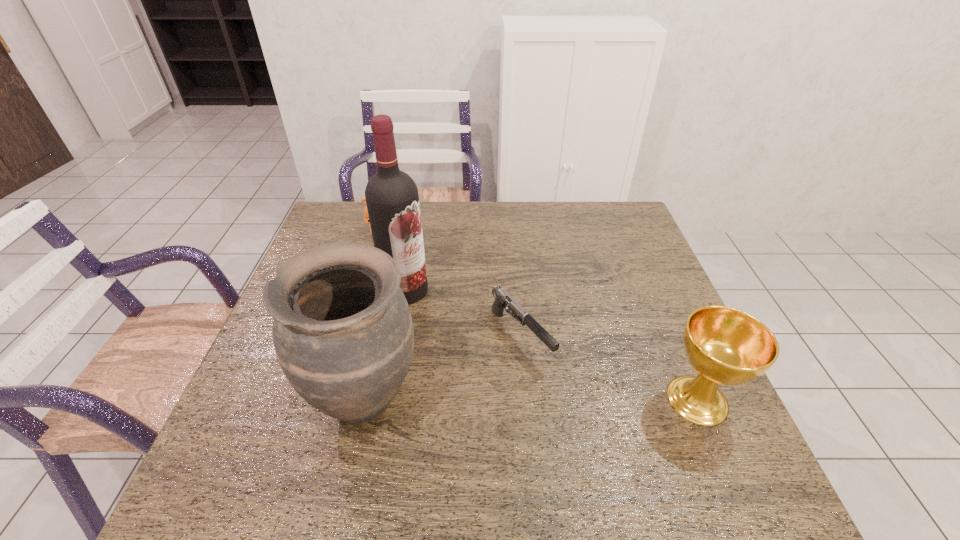
Identify which object is the third closest to the farthest object. Please provide its 2D coordinates. Your answer should be formatted as a tuple, i.e. [(x, y)], where the tuple contains the x and y coordinates of a point satisfying the conditions above.

[(343, 334)]

Locate an element on the screen. object that is the nearest to the gun is located at coordinates (343, 334).

At what (x,y) coordinates should I click in order to perform the action: click on blank space that satisfies the following two spatial constraints: 1. on the front side of the shortest object; 2. on the left side of the tallest object. Please return your answer as a coordinate pair (x, y). Looking at the image, I should click on (397, 336).

Where is `vacant region that satisfies the following two spatial constraints: 1. on the front side of the tallest object; 2. on the right side of the rightmost object`? This screenshot has height=540, width=960. vacant region that satisfies the following two spatial constraints: 1. on the front side of the tallest object; 2. on the right side of the rightmost object is located at coordinates (385, 400).

This screenshot has height=540, width=960. I want to click on free spot that satisfies the following two spatial constraints: 1. on the front side of the third tallest object; 2. on the left side of the teddy bear, so click(334, 400).